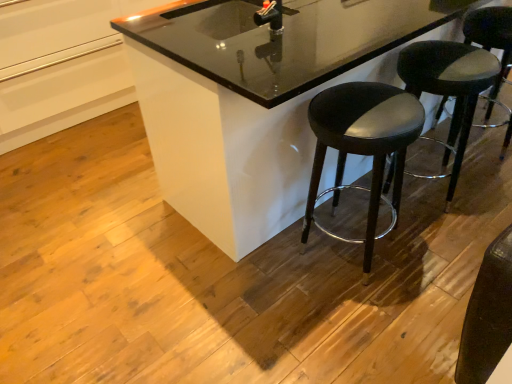
This screenshot has width=512, height=384. What are the coordinates of `empty space that is to the right of black leather stool at lower right, which is the second stool from right to left` in the screenshot? It's located at (483, 196).